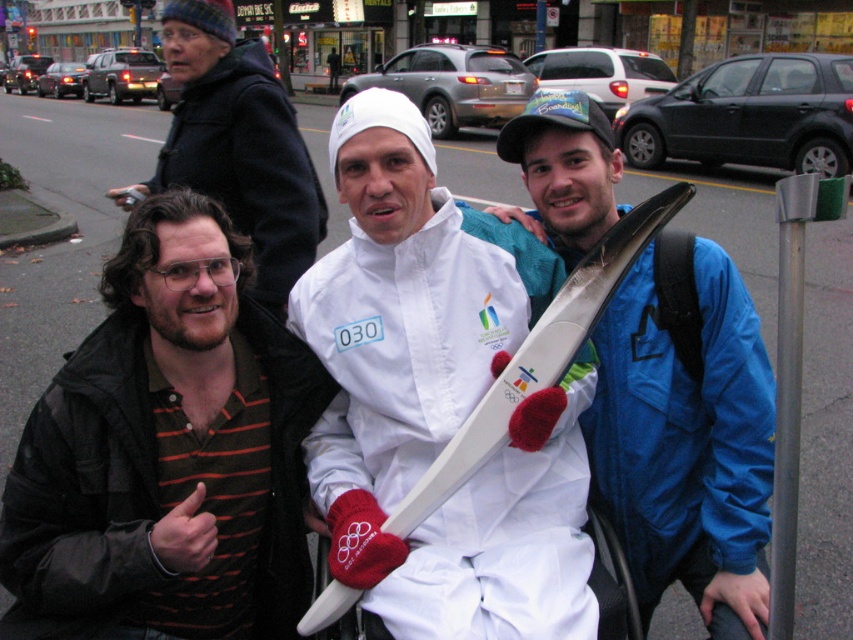
You are a photographer trying to capture a group photo of the two people in the center. The brown striped shirt at center and the blue synthetic jacket at center are both in the frame. Based on their positions, which one is closer to the left edge of the photo?

The brown striped shirt at center is to the left of the blue synthetic jacket at center, so the brown striped shirt at center is closer to the left edge of the photo.

You are a photographer trying to capture a closeup of the white matte olympic torch at center without including the brown striped shirt at center in the frame. Based on their sizes, is this possible?

The brown striped shirt at center is larger in size than the white matte olympic torch at center, so it might be challenging to frame the torch without including the shirt if they are positioned closely together.